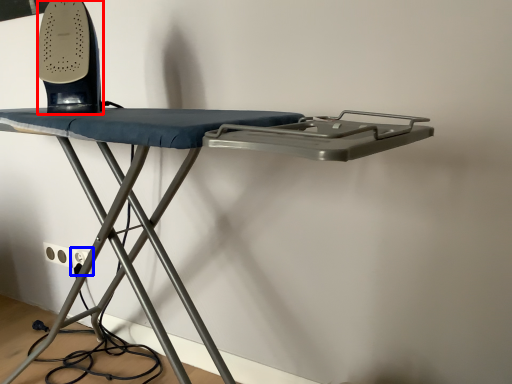
Question: Which object appears closest to the camera in this image, equipment (highlighted by a red box) or electric outlet (highlighted by a blue box)?

Choices:
 (A) equipment
 (B) electric outlet

Answer: (A)